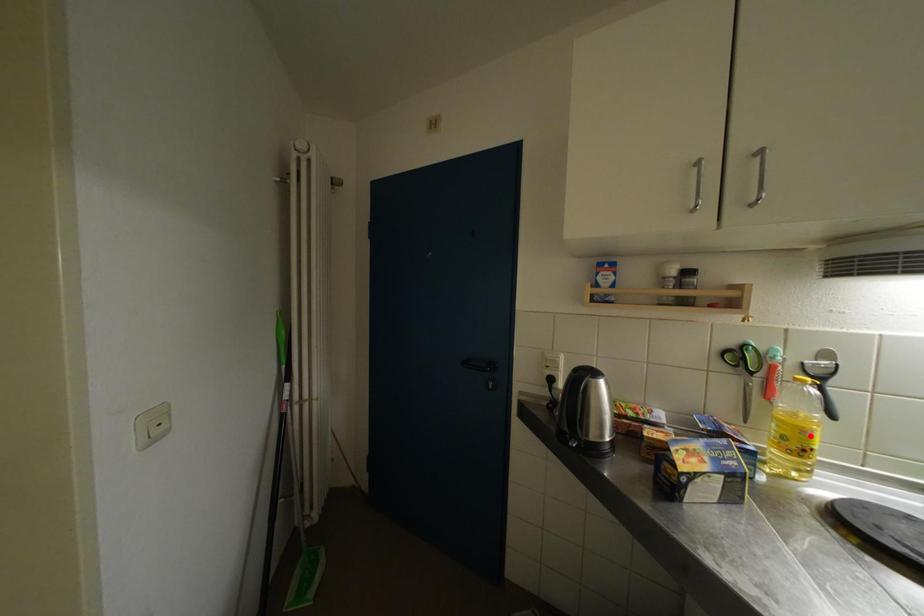
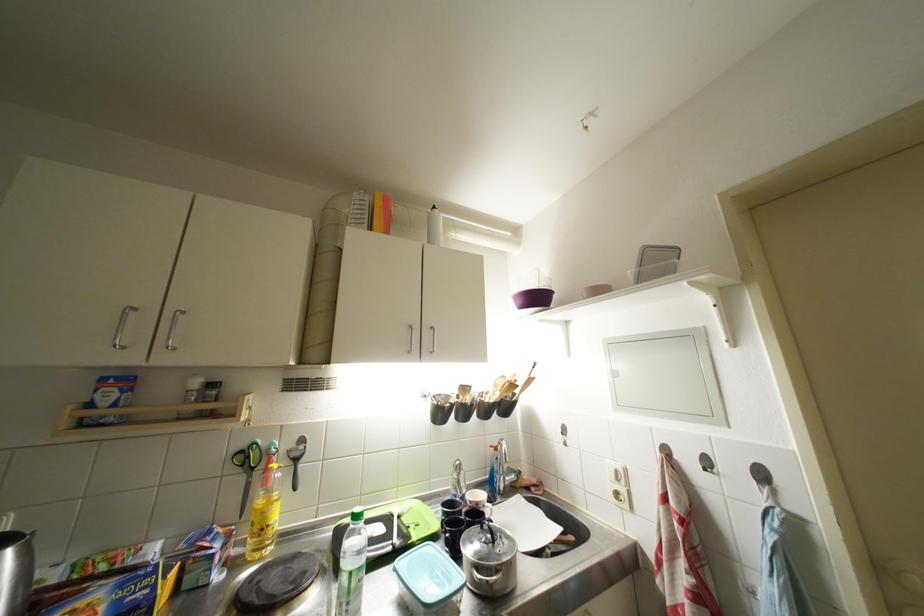
The point at the highlighted location is marked in the first image. Where is the corresponding point in the second image?

(271, 517)